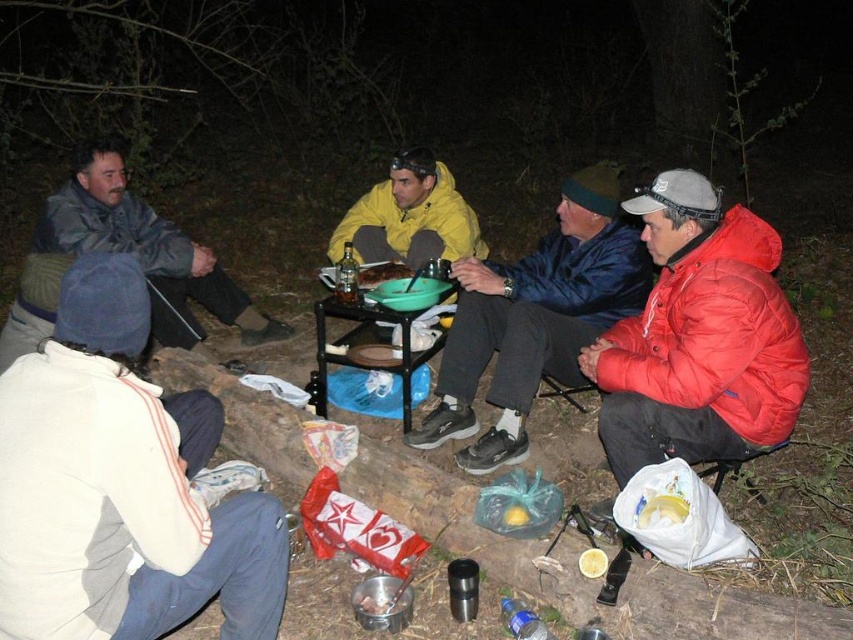
Who is shorter, matte blue jacket at center or yellow waterproof jacket at center?

With less height is yellow waterproof jacket at center.

Is point (512, 385) positioned before point (410, 204)?

Yes, point (512, 385) is in front of point (410, 204).

Between point (509, 374) and point (347, 227), which one is positioned behind?

The point (347, 227) is behind.

The height and width of the screenshot is (640, 853). In order to click on matte blue jacket at center in this screenshot , I will do `click(535, 317)`.

Is gray matte jacket at left to the right of yellow waterproof jacket at center from the viewer's perspective?

Incorrect, gray matte jacket at left is not on the right side of yellow waterproof jacket at center.

Is gray matte jacket at left wider than yellow waterproof jacket at center?

Yes.

The image size is (853, 640). Find the location of `gray matte jacket at left`. gray matte jacket at left is located at coordinates (148, 250).

Between white fleece jacket at lower left and black metal picnic table at center, which one appears on the right side from the viewer's perspective?

black metal picnic table at center

Is point (35, 403) positioned in front of point (322, 340)?

Yes, it is.

Is point (137, 312) more distant than point (328, 388)?

No.

You are a GUI agent. You are given a task and a screenshot of the screen. Output one action in this format:
    pyautogui.click(x=<x>, y=<y>)
    Task: Click on the white fleece jacket at lower left
    The height and width of the screenshot is (640, 853).
    Given the screenshot: What is the action you would take?
    pyautogui.click(x=120, y=484)